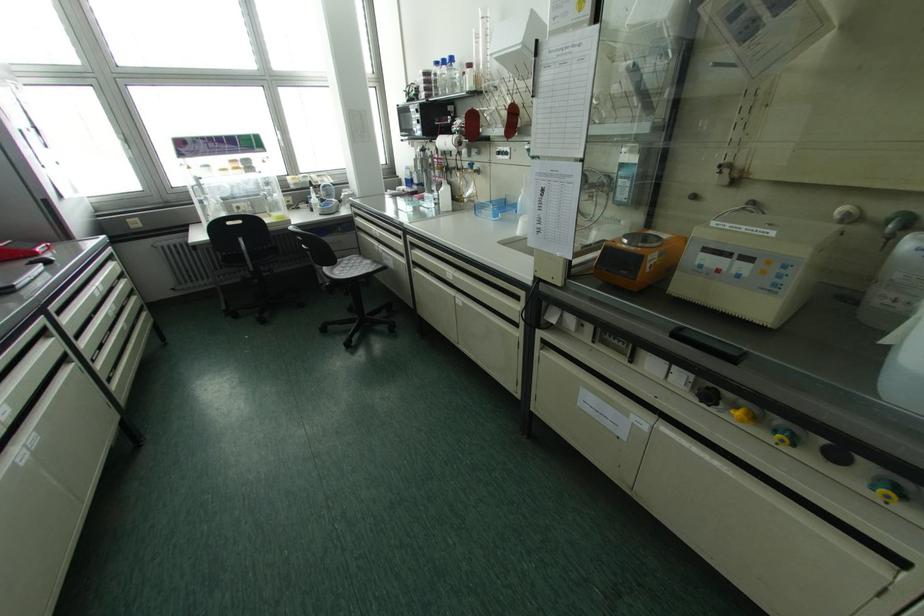
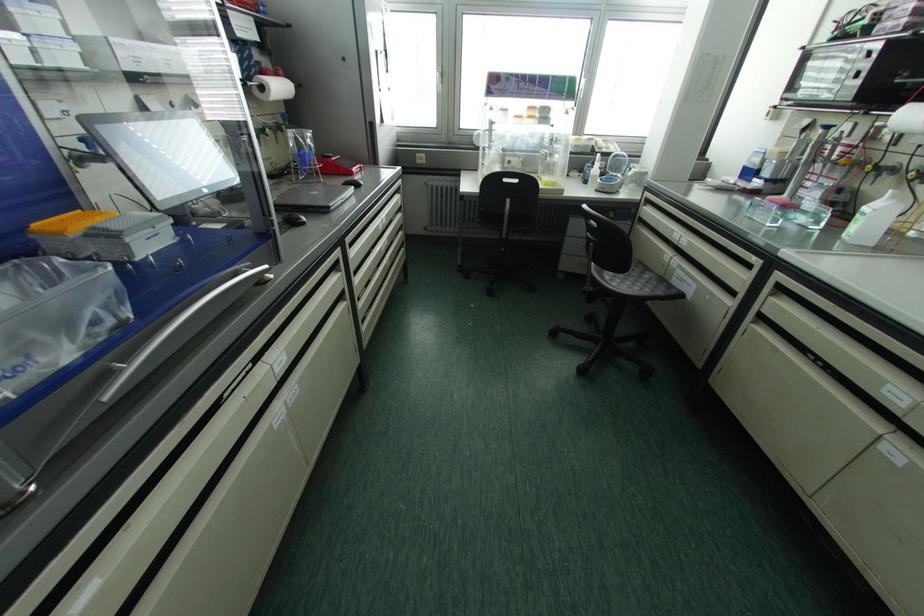
Question: The camera is either moving clockwise (left) or counter-clockwise (right) around the object. The first image is from the beginning of the video and the second image is from the end. Is the camera moving left or right when shooting the video?

Choices:
 (A) Left
 (B) Right

Answer: (B)